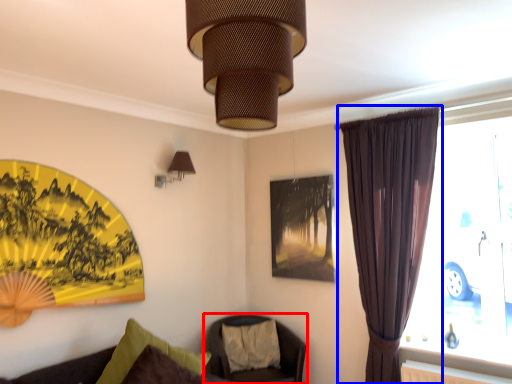
Question: Which point is further to the camera, chair (highlighted by a red box) or curtain (highlighted by a blue box)?

Choices:
 (A) chair
 (B) curtain

Answer: (A)